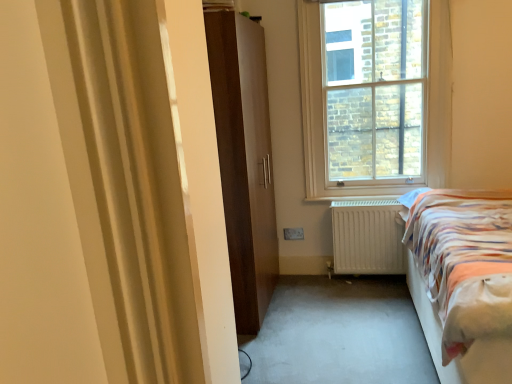
Locate an element on the screen. This screenshot has height=384, width=512. vacant area situated below white matte radiator at lower center (from a real-world perspective) is located at coordinates (364, 276).